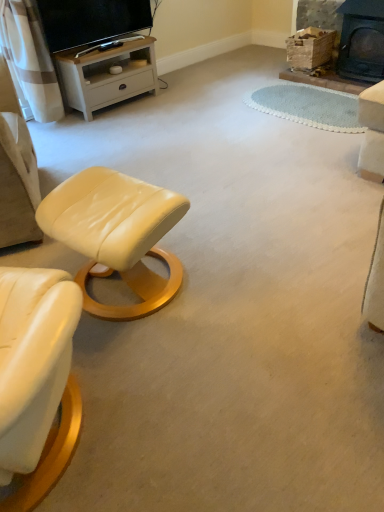
Question: Can you confirm if matte cream leather stool at lower left is wider than matte black tv at upper left?

Choices:
 (A) no
 (B) yes

Answer: (B)

Question: Is matte cream leather stool at lower left not inside matte black tv at upper left?

Choices:
 (A) no
 (B) yes

Answer: (B)

Question: Does matte cream leather stool at lower left have a lesser width compared to matte black tv at upper left?

Choices:
 (A) no
 (B) yes

Answer: (A)

Question: Does matte cream leather stool at lower left lie behind matte black tv at upper left?

Choices:
 (A) no
 (B) yes

Answer: (A)

Question: From the image's perspective, is matte cream leather stool at lower left over matte black tv at upper left?

Choices:
 (A) no
 (B) yes

Answer: (A)

Question: Do you think white wood tv stand at upper left is within matte cream leather stool at lower left, or outside of it?

Choices:
 (A) outside
 (B) inside

Answer: (A)

Question: Considering the positions of point (61, 78) and point (79, 272), is point (61, 78) closer or farther from the camera than point (79, 272)?

Choices:
 (A) farther
 (B) closer

Answer: (A)

Question: Is white wood tv stand at upper left in front of or behind matte cream leather stool at lower left in the image?

Choices:
 (A) behind
 (B) front

Answer: (A)

Question: Considering the relative positions of white wood tv stand at upper left and matte cream leather stool at lower left in the image provided, is white wood tv stand at upper left to the left or to the right of matte cream leather stool at lower left?

Choices:
 (A) right
 (B) left

Answer: (B)

Question: Considering the positions of point (372, 61) and point (115, 1), is point (372, 61) closer or farther from the camera than point (115, 1)?

Choices:
 (A) closer
 (B) farther

Answer: (B)

Question: Looking at the image, does black cast iron fireplace at upper right seem bigger or smaller compared to matte black tv at upper left?

Choices:
 (A) small
 (B) big

Answer: (A)

Question: In terms of width, does black cast iron fireplace at upper right look wider or thinner when compared to matte black tv at upper left?

Choices:
 (A) thin
 (B) wide

Answer: (B)

Question: In the image, is black cast iron fireplace at upper right on the left side or the right side of matte black tv at upper left?

Choices:
 (A) left
 (B) right

Answer: (B)

Question: In the image, is black cast iron fireplace at upper right on the left side or the right side of white wood tv stand at upper left?

Choices:
 (A) right
 (B) left

Answer: (A)

Question: Is black cast iron fireplace at upper right in front of or behind white wood tv stand at upper left in the image?

Choices:
 (A) behind
 (B) front

Answer: (A)